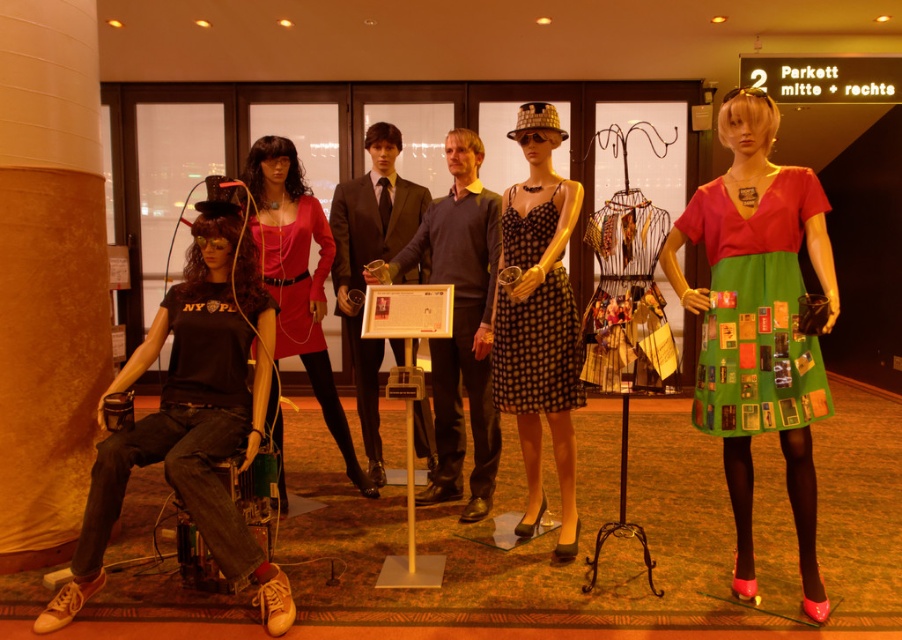
Question: Can you confirm if green chiffon dress at right is positioned below matte black dress at center?

Choices:
 (A) no
 (B) yes

Answer: (B)

Question: Does matte black dress at center appear on the left side of matte pink dress at center?

Choices:
 (A) no
 (B) yes

Answer: (A)

Question: Is the position of matte black t-shirt at left more distant than that of green patchwork dress at right?

Choices:
 (A) no
 (B) yes

Answer: (B)

Question: Which object is closer to the camera taking this photo?

Choices:
 (A) black dotted fabric dress at center
 (B) matte black t-shirt at left
 (C) green chiffon dress at right
 (D) polka dot fabric dress at center

Answer: (C)

Question: Which of the following is the closest to the observer?

Choices:
 (A) matte black t-shirt at left
 (B) matte pink dress at center

Answer: (A)

Question: Which point is closer to the camera?

Choices:
 (A) (283, 269)
 (B) (350, 188)
 (C) (292, 150)
 (D) (549, 138)

Answer: (D)